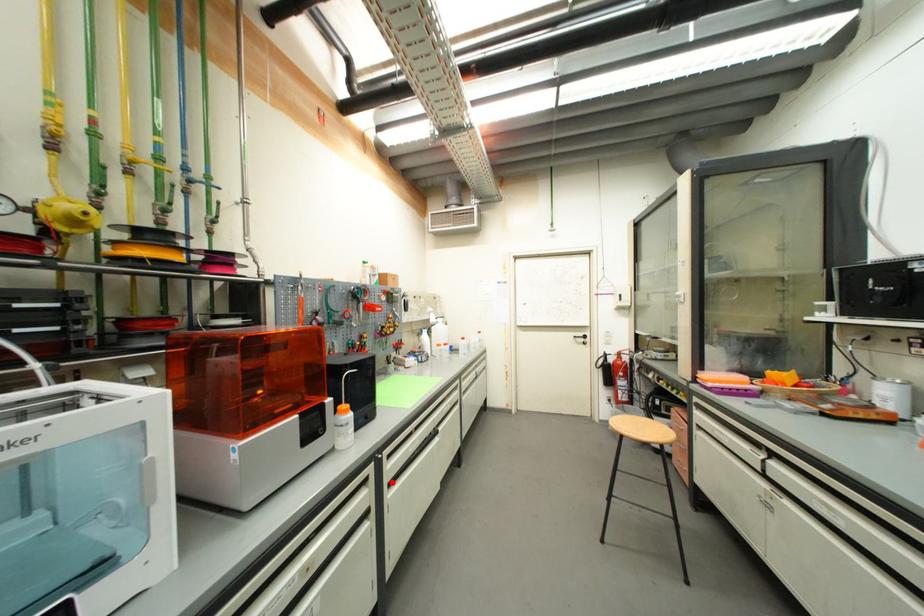
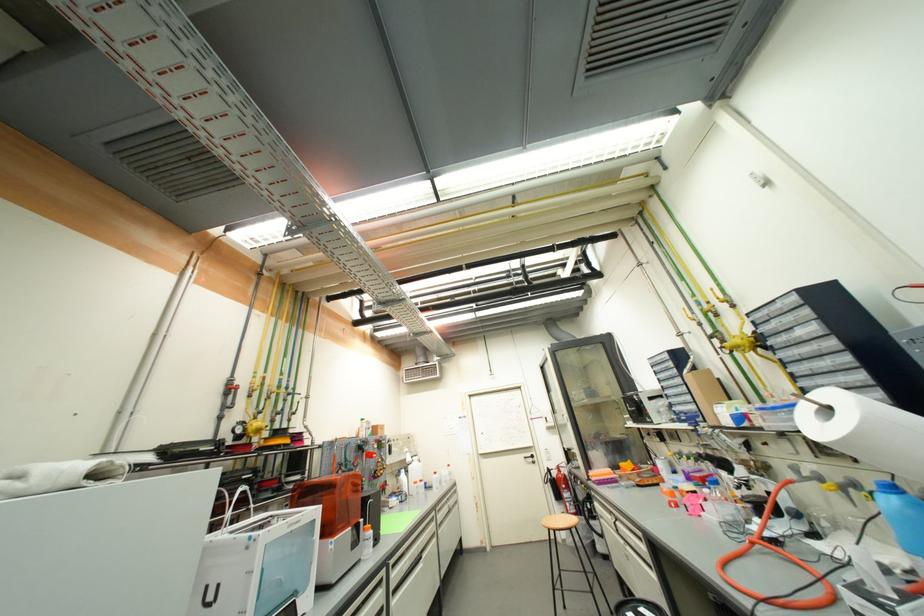
Find the pixel in the second image that matches the highlighted location in the first image.

(396, 590)